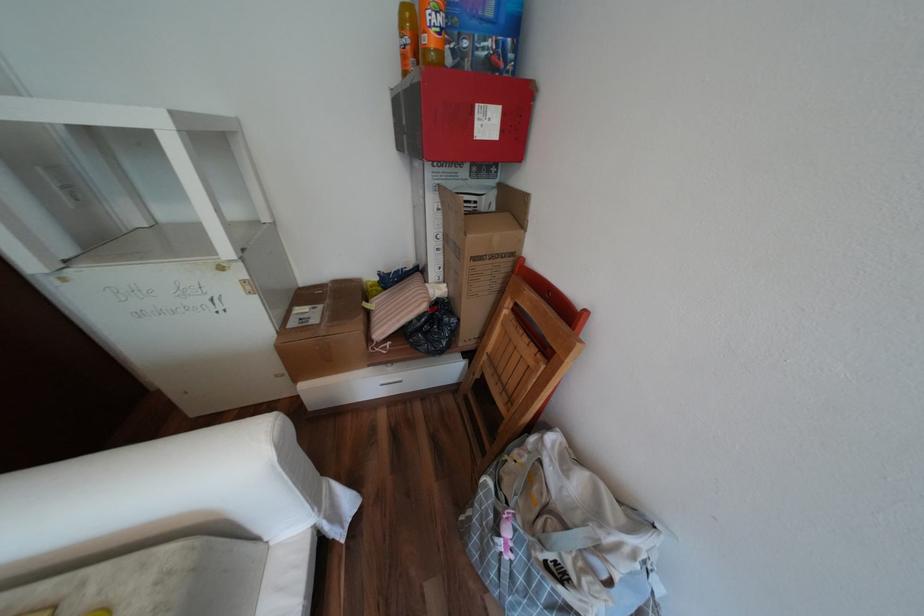
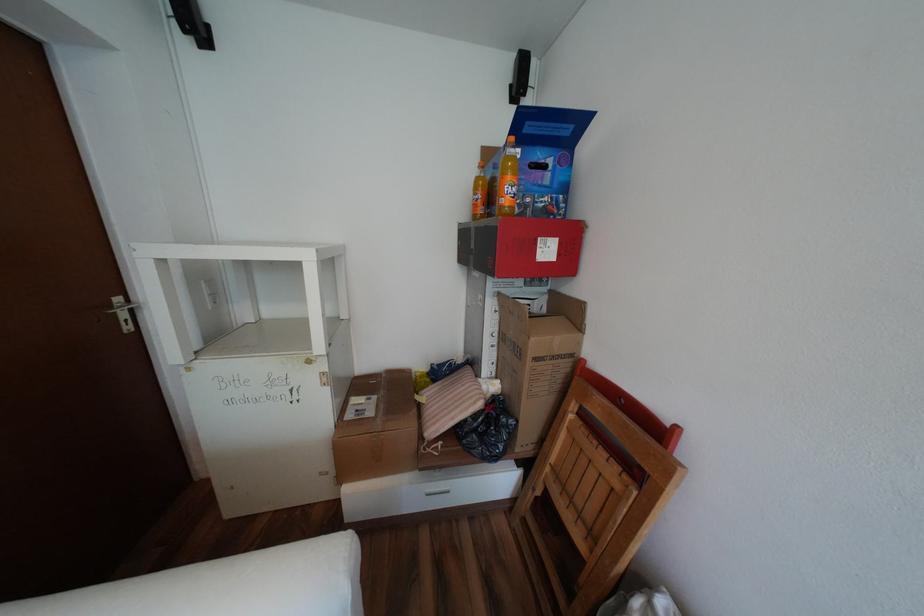
Where in the second image is the point corresponding to (496,124) from the first image?

(556, 251)